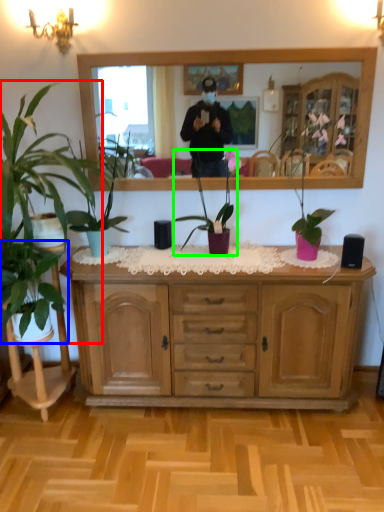
Question: Considering the real-world distances, which object is farthest from houseplant (highlighted by a red box)? houseplant (highlighted by a blue box) or houseplant (highlighted by a green box)?

Choices:
 (A) houseplant
 (B) houseplant

Answer: (B)